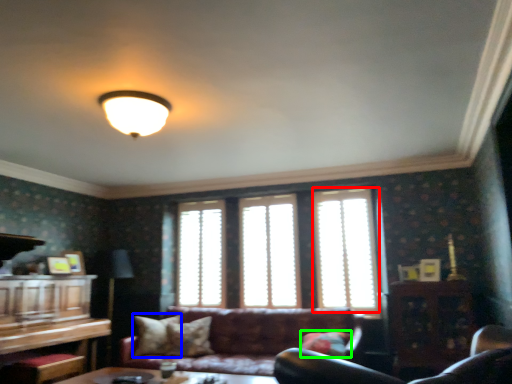
Question: Which object is positioned closest to window (highlighted by a red box)? Select from pillow (highlighted by a blue box) and pillow (highlighted by a green box).

Choices:
 (A) pillow
 (B) pillow

Answer: (B)